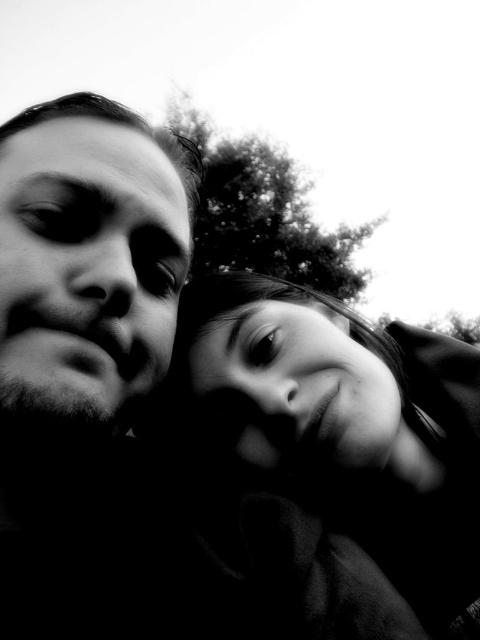
Question: Does smooth skin face at center appear over smooth skin face at left?

Choices:
 (A) yes
 (B) no

Answer: (B)

Question: Can you confirm if smooth skin face at center is positioned below smooth skin face at left?

Choices:
 (A) yes
 (B) no

Answer: (A)

Question: Which of the following is the farthest from the observer?

Choices:
 (A) smooth skin face at center
 (B) smooth skin face at left

Answer: (A)

Question: Is smooth skin face at center smaller than smooth skin face at left?

Choices:
 (A) yes
 (B) no

Answer: (B)